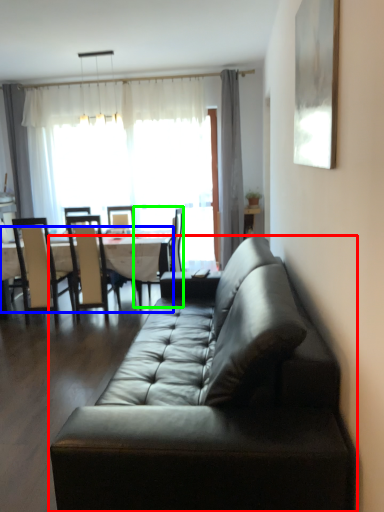
Question: Considering the real-world distances, which object is farthest from studio couch (highlighted by a red box)? kitchen & dining room table (highlighted by a blue box) or chair (highlighted by a green box)?

Choices:
 (A) kitchen & dining room table
 (B) chair

Answer: (B)